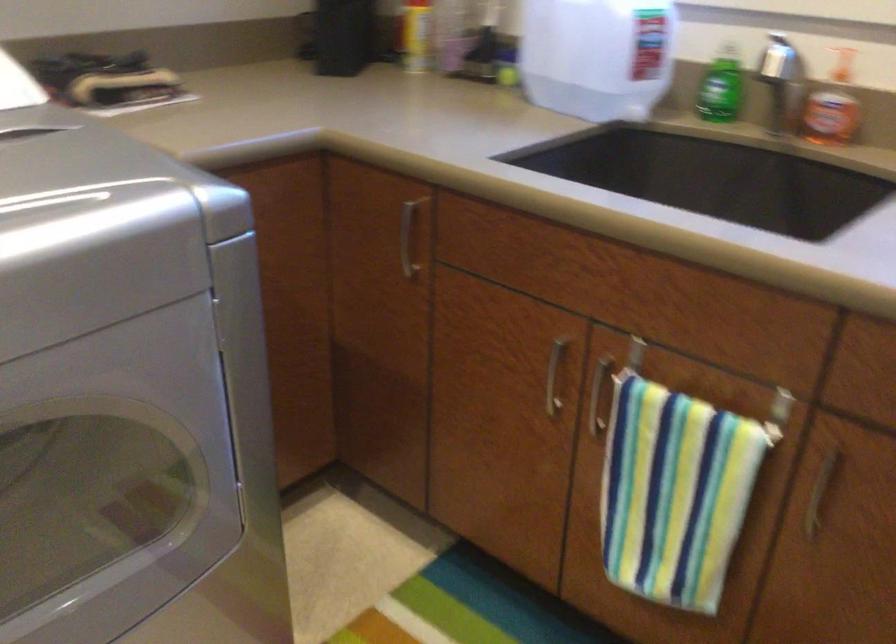
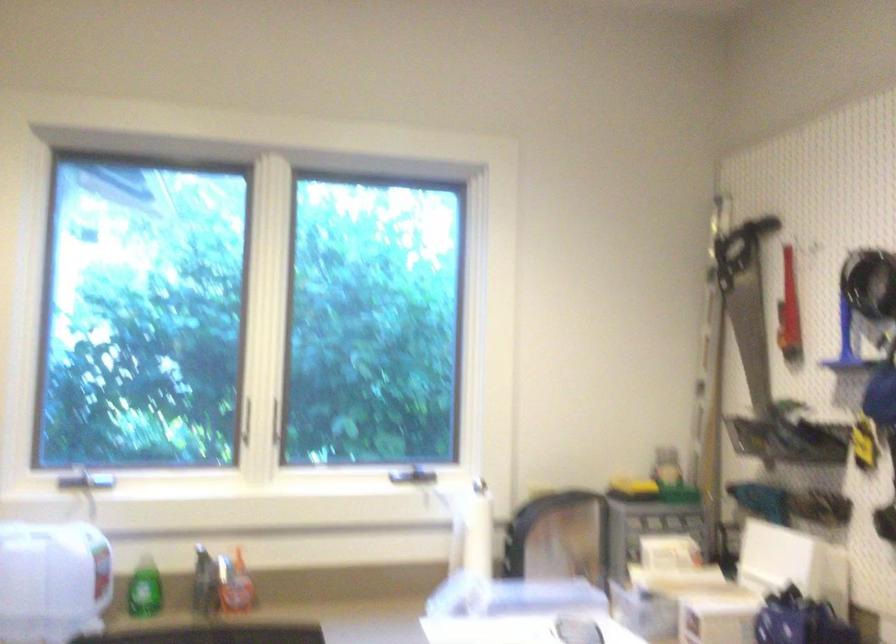
In the second image, find the point that corresponds to pixel 823 104 in the first image.

(234, 583)